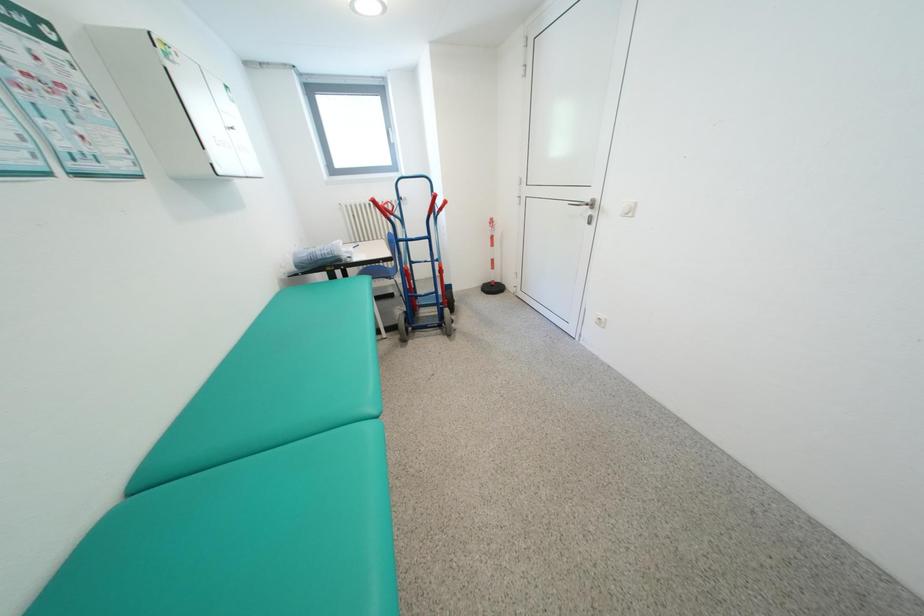
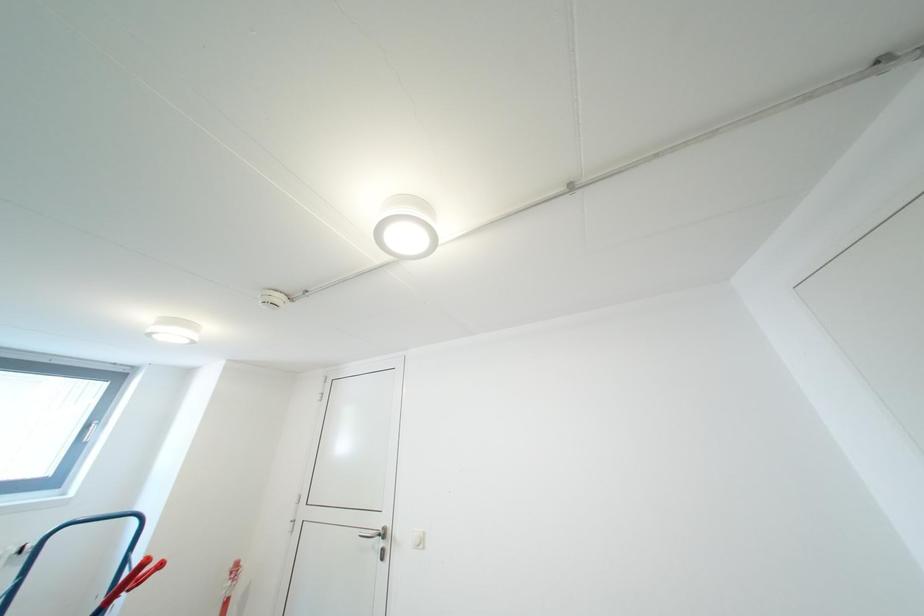
Based on the continuous images, in which direction is the camera rotating?

The camera rotated toward right-up.